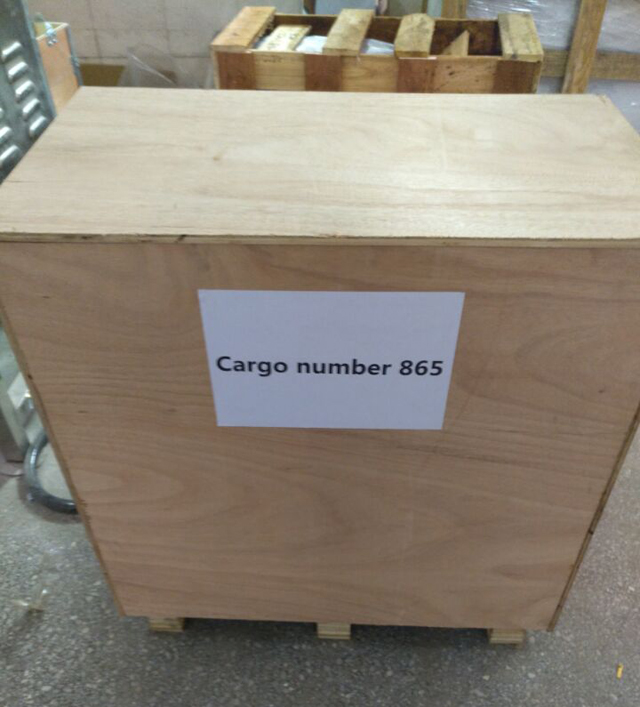
You are a GUI agent. You are given a task and a screenshot of the screen. Output one action in this format:
    pyautogui.click(x=<x>, y=<y>)
    Task: Click on the wooden box
    This screenshot has height=707, width=640.
    Given the screenshot: What is the action you would take?
    pyautogui.click(x=419, y=204), pyautogui.click(x=163, y=534)